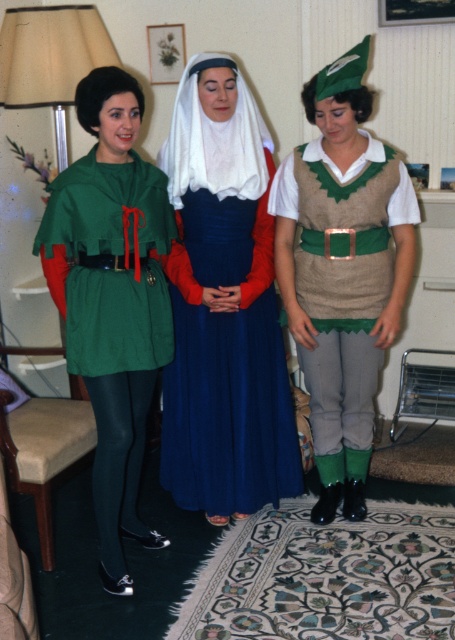
Is blue satin dress at center taller than knitted beige vest at center?

No.

Between point (207, 209) and point (278, 262), which one is positioned behind?

The point (278, 262) is behind.

Locate an element on the screen. blue satin dress at center is located at coordinates (223, 305).

Between point (193, 177) and point (131, 161), which one is positioned behind?

The point (193, 177) is behind.

Is blue satin dress at center positioned before green fabric cape at left?

No.

Is point (210, 381) less distant than point (131, 588)?

That is False.

The height and width of the screenshot is (640, 455). I want to click on blue satin dress at center, so click(x=223, y=305).

Can you confirm if knitted beige vest at center is thinner than green fabric cape at left?

Incorrect, knitted beige vest at center's width is not less than green fabric cape at left's.

Who is higher up, knitted beige vest at center or green fabric cape at left?

Positioned higher is knitted beige vest at center.

Which is behind, point (306, 240) or point (84, 380)?

The point (306, 240) is more distant.

Where is `knitted beige vest at center`? The height and width of the screenshot is (640, 455). knitted beige vest at center is located at coordinates (343, 269).